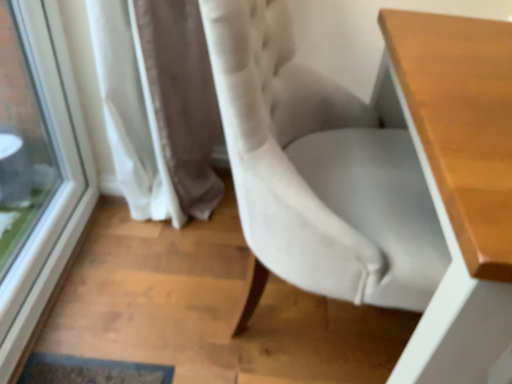
Locate an element on the screen. This screenshot has width=512, height=384. velvet white chair at center is located at coordinates (319, 169).

What is the approximate height of white textured curtain at lower left?

The height of white textured curtain at lower left is 32.50 inches.

Identify the location of velvet white chair at center. (319, 169).

From a real-world perspective, between velvet white chair at center and white textured curtain at lower left, who is vertically lower?

white textured curtain at lower left, from a real-world perspective.

Does velvet white chair at center have a larger size compared to white textured curtain at lower left?

Yes, velvet white chair at center is bigger than white textured curtain at lower left.

Can you confirm if velvet white chair at center is positioned to the right of white textured curtain at lower left?

Indeed, velvet white chair at center is positioned on the right side of white textured curtain at lower left.

In terms of height, does velvet white chair at center look taller or shorter compared to white textured curtain at lower left?

Considering their sizes, velvet white chair at center has more height than white textured curtain at lower left.

Does transparent glass window at left have a lesser height compared to velvet white chair at center?

Yes.

Which point is more distant from viewer, [23,12] or [411,195]?

The point [23,12] is behind.

From a real-world perspective, is transparent glass window at left positioned over velvet white chair at center based on gravity?

Incorrect, from a real-world perspective, transparent glass window at left is lower than velvet white chair at center.

Which of these two, wooden table at right or white textured curtain at lower left, stands shorter?

With less height is wooden table at right.

From the image's perspective, is wooden table at right over white textured curtain at lower left?

No, from the image's perspective, wooden table at right is not above white textured curtain at lower left.

Considering the positions of point (430, 136) and point (125, 194), is point (430, 136) closer or farther from the camera than point (125, 194)?

Clearly, point (430, 136) is closer to the camera than point (125, 194).

From a real-world perspective, is wooden table at right physically located above or below white textured curtain at lower left?

From a real-world perspective, wooden table at right is physically above white textured curtain at lower left.

Considering the positions of point (54, 55) and point (162, 84), is point (54, 55) closer or farther from the camera than point (162, 84)?

Point (54, 55) is farther from the camera than point (162, 84).

Which object is positioned more to the left, transparent glass window at left or white textured curtain at lower left?

transparent glass window at left is more to the left.

Does transparent glass window at left have a larger size compared to white textured curtain at lower left?

No, transparent glass window at left is not bigger than white textured curtain at lower left.

Do you think transparent glass window at left is within wooden table at right, or outside of it?

transparent glass window at left is spatially situated outside wooden table at right.

Can you confirm if transparent glass window at left is positioned to the right of wooden table at right?

No, transparent glass window at left is not to the right of wooden table at right.

Does point (57, 122) appear closer or farther from the camera than point (426, 313)?

Point (57, 122).

Does transparent glass window at left have a lesser height compared to wooden table at right?

Yes, transparent glass window at left is shorter than wooden table at right.

Considering the relative positions of wooden table at right and transparent glass window at left in the image provided, is wooden table at right to the left or to the right of transparent glass window at left?

From the image, it's evident that wooden table at right is to the right of transparent glass window at left.

Could you tell me if wooden table at right is turned towards transparent glass window at left?

No, wooden table at right is not oriented towards transparent glass window at left.

Are wooden table at right and transparent glass window at left far apart?

Yes, wooden table at right is far from transparent glass window at left.

From a real-world perspective, who is located higher, wooden table at right or transparent glass window at left?

In real-world perspective, transparent glass window at left is above.

Does point (122, 20) come closer to viewer compared to point (283, 180)?

No.

From the image's perspective, which object appears higher, white textured curtain at lower left or velvet white chair at center?

From the image's view, white textured curtain at lower left is above.

Based on the photo, in terms of width, does white textured curtain at lower left look wider or thinner when compared to velvet white chair at center?

Clearly, white textured curtain at lower left has less width compared to velvet white chair at center.

Is white textured curtain at lower left not near velvet white chair at center?

No, white textured curtain at lower left is in close proximity to velvet white chair at center.

There is a white textured curtain at lower left. Find the location of `chair above it (from a real-world perspective)`. chair above it (from a real-world perspective) is located at coordinates (319, 169).

Locate an element on the screen. window below the velvet white chair at center (from a real-world perspective) is located at coordinates pyautogui.click(x=37, y=172).

Estimate the real-world distances between objects in this image. Which object is further from velvet white chair at center, wooden table at right or transparent glass window at left?

transparent glass window at left lies further to velvet white chair at center than the other object.

Based on their spatial positions, is velvet white chair at center or transparent glass window at left closer to wooden table at right?

velvet white chair at center is positioned closer to the anchor wooden table at right.

When comparing their distances from white textured curtain at lower left, does wooden table at right or transparent glass window at left seem closer?

transparent glass window at left is closer to white textured curtain at lower left.

Looking at the image, which one is located further to velvet white chair at center, transparent glass window at left or white textured curtain at lower left?

The object further to velvet white chair at center is transparent glass window at left.

Which object lies nearer to the anchor point wooden table at right, white textured curtain at lower left or transparent glass window at left?

Among the two, white textured curtain at lower left is located nearer to wooden table at right.

Which object lies further to the anchor point white textured curtain at lower left, velvet white chair at center or transparent glass window at left?

Based on the image, velvet white chair at center appears to be further to white textured curtain at lower left.

Which object lies nearer to the anchor point transparent glass window at left, white textured curtain at lower left or velvet white chair at center?

Based on the image, white textured curtain at lower left appears to be nearer to transparent glass window at left.

Looking at the image, which one is located closer to transparent glass window at left, wooden table at right or white textured curtain at lower left?

Based on the image, white textured curtain at lower left appears to be nearer to transparent glass window at left.

Locate an element on the screen. The image size is (512, 384). curtain between transparent glass window at left and wooden table at right in the horizontal direction is located at coordinates (158, 105).

The height and width of the screenshot is (384, 512). In order to click on chair between transparent glass window at left and wooden table at right in the horizontal direction in this screenshot , I will do `click(319, 169)`.

Locate an element on the screen. curtain between transparent glass window at left and velvet white chair at center from left to right is located at coordinates (158, 105).

I want to click on chair situated between white textured curtain at lower left and wooden table at right from left to right, so click(x=319, y=169).